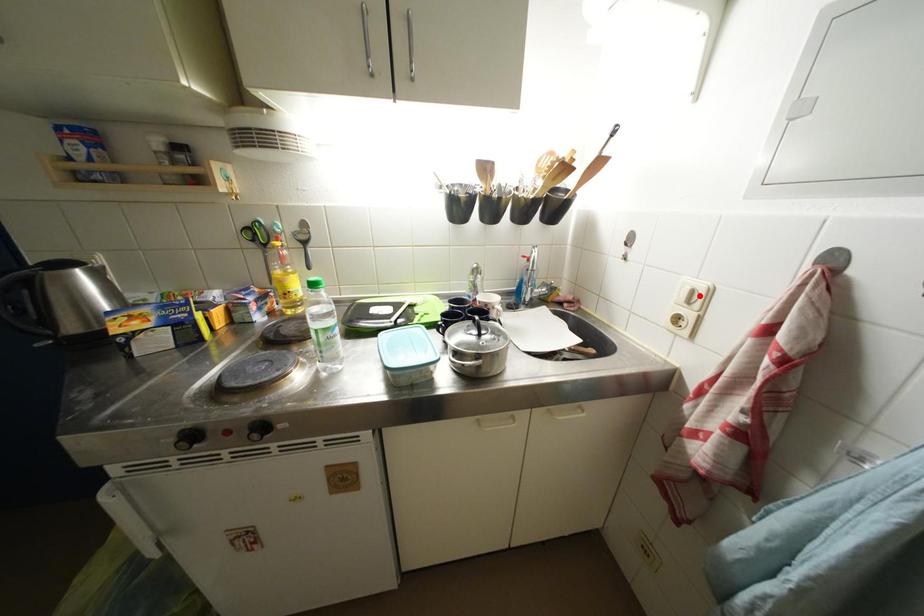
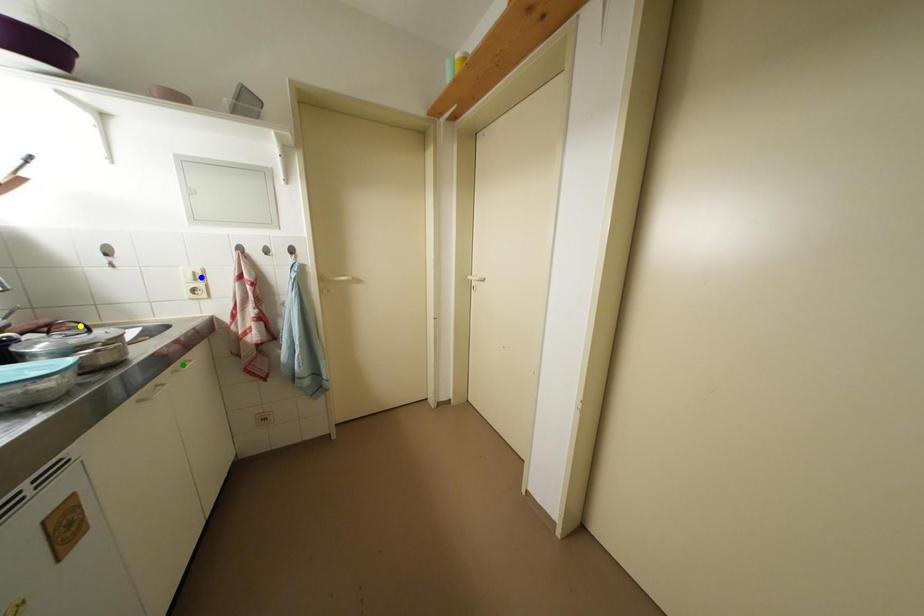
Question: I am providing you with two images of the same scene from different viewpoints. A red point is marked on the first image. You are given multiple points on the second image. Which spot in image 2 lines up with the point in image 1?

Choices:
 (A) yellow point
 (B) blue point
 (C) green point

Answer: (B)